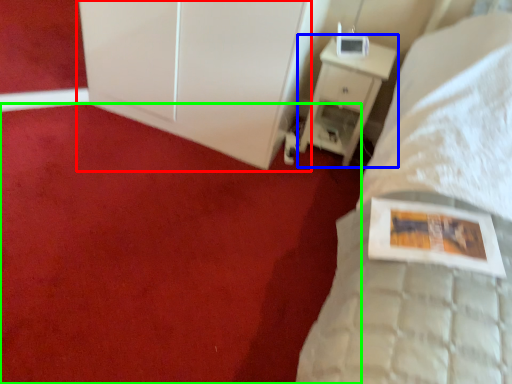
Question: Considering the real-world distances, which object is closest to dresser (highlighted by a red box)? nightstand (highlighted by a blue box) or plain (highlighted by a green box).

Choices:
 (A) nightstand
 (B) plain

Answer: (A)